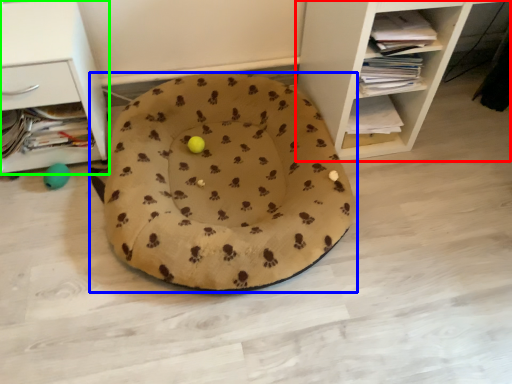
Question: Estimate the real-world distances between objects in this image. Which object is farther from shelf (highlighted by a red box), dog bed (highlighted by a blue box) or shelf (highlighted by a green box)?

Choices:
 (A) dog bed
 (B) shelf

Answer: (B)